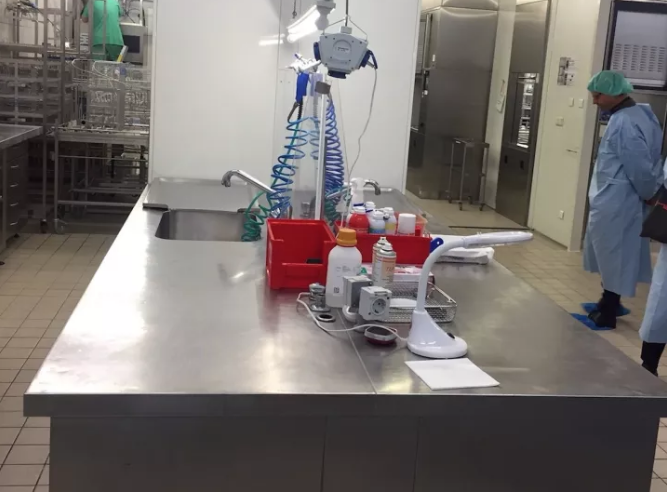
Identify the location of click here to turn on lamp. Image resolution: width=667 pixels, height=492 pixels. (451, 334).